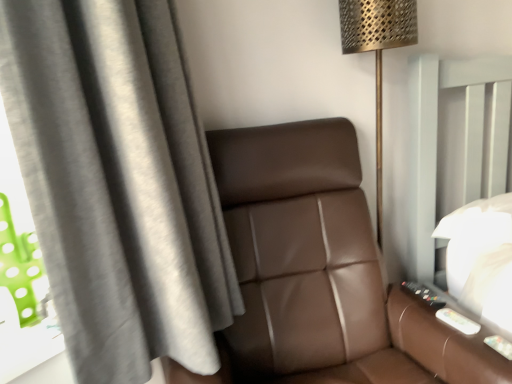
Question: From the image's perspective, would you say metallic gold floor lamp at upper right is positioned over gray fabric curtain at left?

Choices:
 (A) no
 (B) yes

Answer: (B)

Question: Is metallic gold floor lamp at upper right further to the viewer compared to gray fabric curtain at left?

Choices:
 (A) yes
 (B) no

Answer: (A)

Question: Is metallic gold floor lamp at upper right closer to the viewer compared to gray fabric curtain at left?

Choices:
 (A) no
 (B) yes

Answer: (A)

Question: Is metallic gold floor lamp at upper right directly adjacent to gray fabric curtain at left?

Choices:
 (A) yes
 (B) no

Answer: (B)

Question: Is metallic gold floor lamp at upper right not inside gray fabric curtain at left?

Choices:
 (A) no
 (B) yes

Answer: (B)

Question: Is brown leather chair at center spatially inside metallic gold floor lamp at upper right, or outside of it?

Choices:
 (A) outside
 (B) inside

Answer: (A)

Question: Is brown leather chair at center wider or thinner than metallic gold floor lamp at upper right?

Choices:
 (A) wide
 (B) thin

Answer: (A)

Question: Is point (223, 349) closer or farther from the camera than point (352, 6)?

Choices:
 (A) closer
 (B) farther

Answer: (A)

Question: Looking at the image, does brown leather chair at center seem bigger or smaller compared to metallic gold floor lamp at upper right?

Choices:
 (A) small
 (B) big

Answer: (B)

Question: Looking at the image, does brown leather chair at center seem bigger or smaller compared to gray fabric curtain at left?

Choices:
 (A) small
 (B) big

Answer: (B)

Question: Is brown leather chair at center in front of or behind gray fabric curtain at left in the image?

Choices:
 (A) front
 (B) behind

Answer: (A)

Question: Looking at their shapes, would you say brown leather chair at center is wider or thinner than gray fabric curtain at left?

Choices:
 (A) thin
 (B) wide

Answer: (B)

Question: Is brown leather chair at center spatially inside gray fabric curtain at left, or outside of it?

Choices:
 (A) inside
 (B) outside

Answer: (B)

Question: From the image's perspective, is gray fabric curtain at left located above or below brown leather chair at center?

Choices:
 (A) above
 (B) below

Answer: (A)

Question: Is gray fabric curtain at left in front of or behind brown leather chair at center in the image?

Choices:
 (A) front
 (B) behind

Answer: (B)